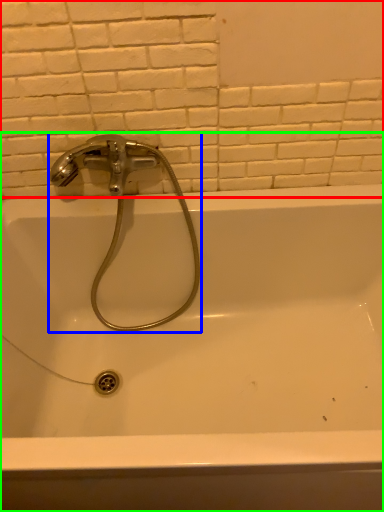
Question: Based on their relative distances, which object is nearer to ceramic tile (highlighted by a red box)? Choose from tap (highlighted by a blue box) and bathtub (highlighted by a green box).

Choices:
 (A) tap
 (B) bathtub

Answer: (A)